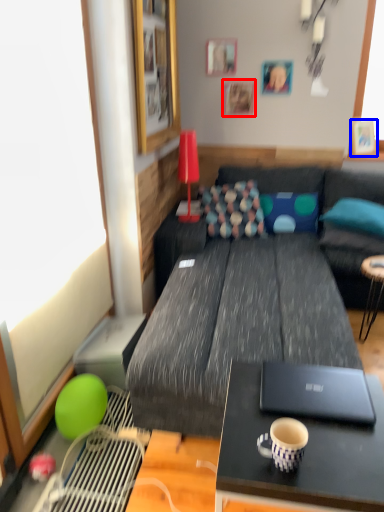
Question: Which of the following is the farthest to the observer, picture frame (highlighted by a red box) or picture frame (highlighted by a blue box)?

Choices:
 (A) picture frame
 (B) picture frame

Answer: (A)